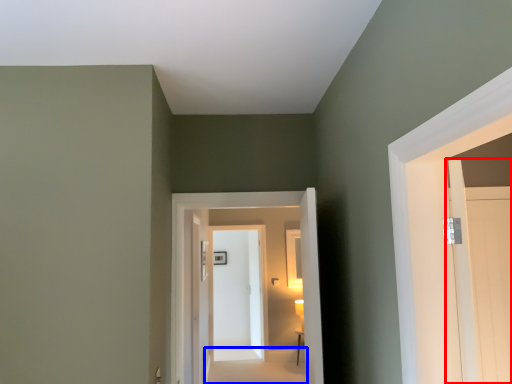
Question: Which point is closer to the camera, door (highlighted by a red box) or path (highlighted by a blue box)?

Choices:
 (A) door
 (B) path

Answer: (A)